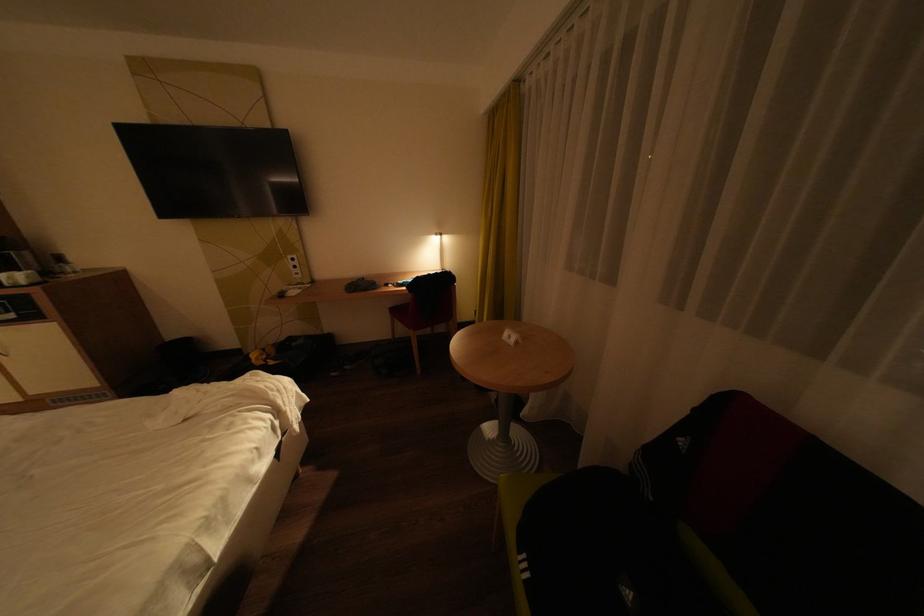
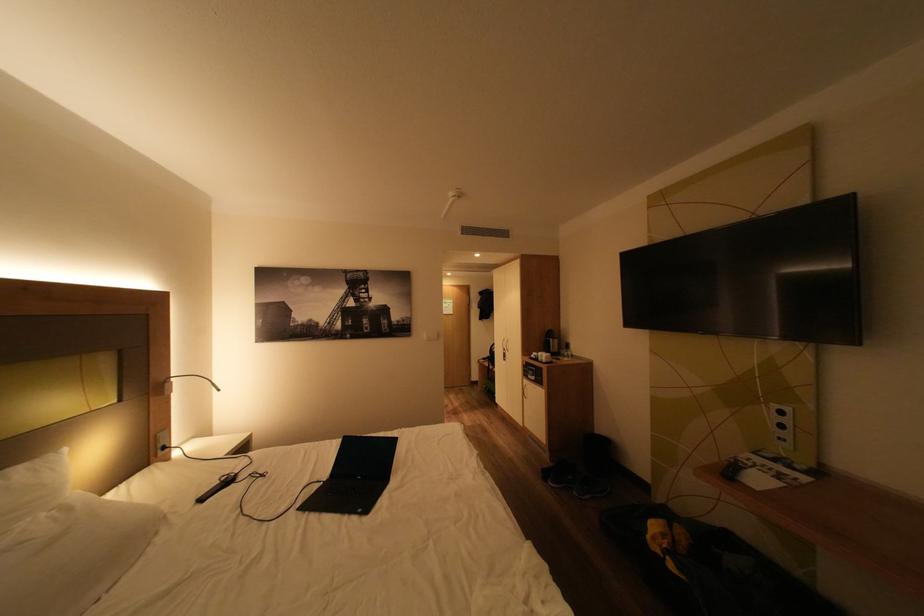
In the second image, find the point that corresponds to pixel 274 358 in the first image.

(675, 546)